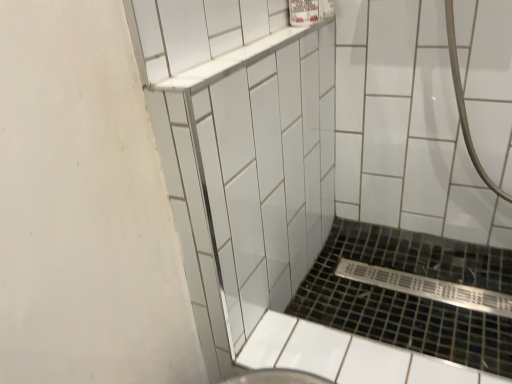
Describe the element at coordinates (411, 295) in the screenshot. The image size is (512, 384). I see `black mosaic tile bath at lower right` at that location.

Measure the distance between point (406, 304) and camera.

The depth of point (406, 304) is 36.22 inches.

Identify the location of black mosaic tile bath at lower right. This screenshot has width=512, height=384. (411, 295).

Find the location of a particular element. Image resolution: width=512 pixels, height=384 pixels. black mosaic tile bath at lower right is located at coordinates (411, 295).